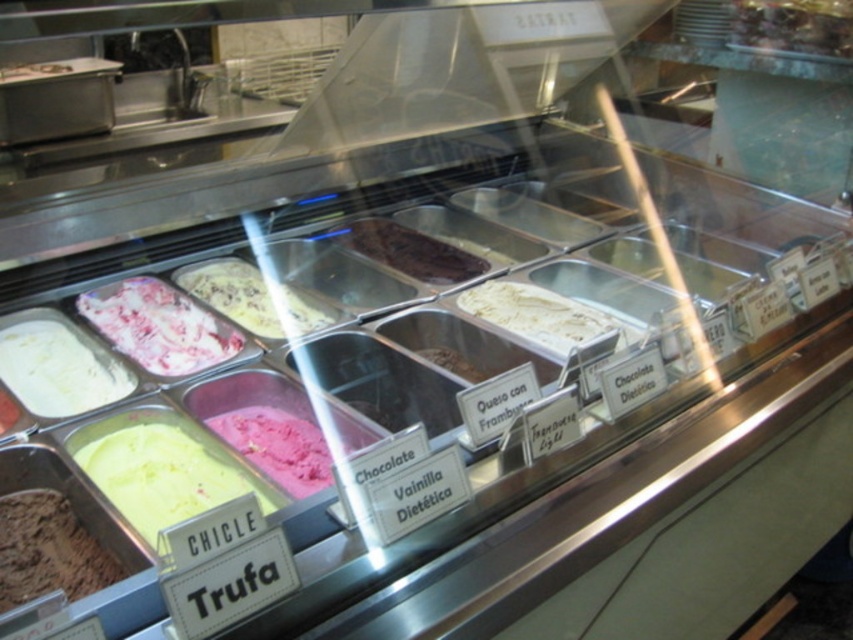
Which is more to the right, chocolate creamy ice cream at lower left or chocolate creamy ice cream at center?

Positioned to the right is chocolate creamy ice cream at center.

Which of these two, chocolate creamy ice cream at lower left or chocolate creamy ice cream at center, stands taller?

Standing taller between the two is chocolate creamy ice cream at lower left.

Who is more forward, (83, 595) or (462, 355)?

Point (83, 595) is more forward.

Find the location of a particular element. chocolate creamy ice cream at lower left is located at coordinates (48, 550).

Can you confirm if chocolate creamy ice cream at lower left is positioned below chocolatesmoothice cream at center?

Yes.

Does point (44, 524) come farther from viewer compared to point (379, 250)?

No, it is in front of (379, 250).

Does point (61, 570) lie behind point (392, 241)?

No, it is in front of (392, 241).

The image size is (853, 640). In order to click on chocolate creamy ice cream at lower left in this screenshot , I will do `click(48, 550)`.

Does chocolate creamy ice cream at lower left have a lesser width compared to pink creamy ice cream at center left?

Yes, chocolate creamy ice cream at lower left is thinner than pink creamy ice cream at center left.

Between chocolate creamy ice cream at lower left and pink creamy ice cream at center left, which one has more height?

pink creamy ice cream at center left is taller.

Find the location of `chocolate creamy ice cream at lower left`. chocolate creamy ice cream at lower left is located at coordinates (48, 550).